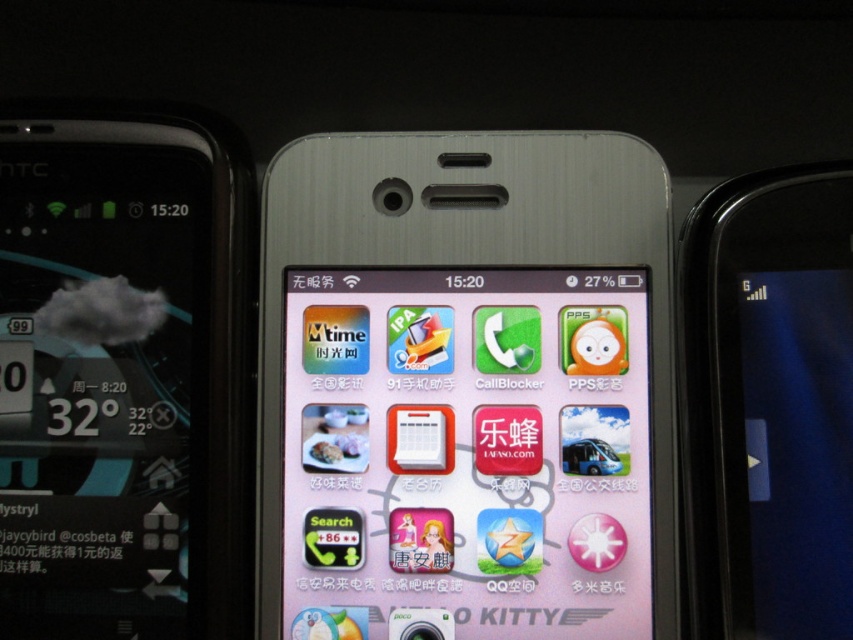
You are holding a smartphone case that is 1.0 meters in length. You want to place it on the matte pink phone at center. Can the case fit on the phone?

The matte pink phone at center is 1.01 meters away from the camera, so the case which is 1.0 meters long can fit on the matte pink phone at center since it is slightly shorter than the distance from the camera.

You have two smartphones in front of you, the matte pink phone at center and the black glossy smartphone at right. Which one is larger in size?

The black glossy smartphone at right is larger in size compared to the matte pink phone at center.